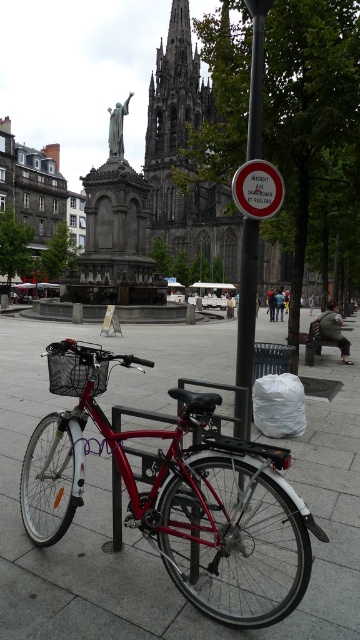
From the picture: You are a delivery person who needs to place a package on the ground between the white paper sign at center and the matte black basket at center. The package requires a minimum of 5 meters of space to ensure it doesn not obstruct pedestrians. Can you safely place the package there?

The distance between the white paper sign at center and the matte black basket at center is 6.54 meters, which exceeds the required 5 meters. Therefore, you can safely place the package there without obstructing pedestrians.

In the scene shown: You are standing in the public square and want to determine which of the two points, point (240, 417) or point (267, 202), is nearer to you. Based on the scene description, which point is closer?

Point (240, 417) is closer to the viewer than point (267, 202).

You are a delivery person who needs to place a package on the ground between the metallic pole at center and the white paper sign at center. Can you do that without moving either object?

The metallic pole at center is in front of the white paper sign at center, so there is space between them where you can place the package.